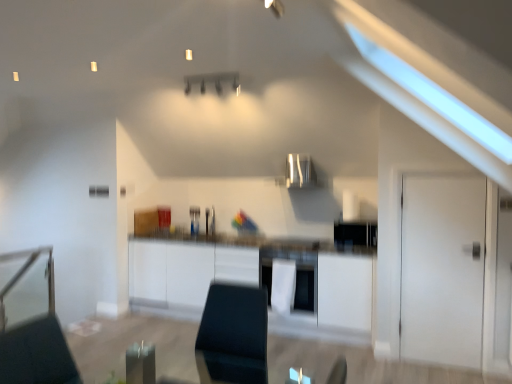
Question: Is white matte cabinet at center taller than satin silver exhaust hood at center?

Choices:
 (A) no
 (B) yes

Answer: (B)

Question: Would you say white matte cabinet at center is outside satin silver exhaust hood at center?

Choices:
 (A) yes
 (B) no

Answer: (A)

Question: From a real-world perspective, is white matte cabinet at center on satin silver exhaust hood at center?

Choices:
 (A) no
 (B) yes

Answer: (A)

Question: Does white matte cabinet at center have a lesser height compared to satin silver exhaust hood at center?

Choices:
 (A) no
 (B) yes

Answer: (A)

Question: Is white matte cabinet at center facing towards satin silver exhaust hood at center?

Choices:
 (A) yes
 (B) no

Answer: (B)

Question: Considering the positions of white glossy oven at center and satin silver exhaust hood at center in the image, is white glossy oven at center bigger or smaller than satin silver exhaust hood at center?

Choices:
 (A) big
 (B) small

Answer: (A)

Question: Looking at their shapes, would you say white glossy oven at center is wider or thinner than satin silver exhaust hood at center?

Choices:
 (A) thin
 (B) wide

Answer: (B)

Question: From their relative heights in the image, would you say white glossy oven at center is taller or shorter than satin silver exhaust hood at center?

Choices:
 (A) short
 (B) tall

Answer: (B)

Question: Considering their positions, is white glossy oven at center located in front of or behind satin silver exhaust hood at center?

Choices:
 (A) front
 (B) behind

Answer: (A)

Question: Relative to white matte cabinet at center, is white matte door at right in front or behind?

Choices:
 (A) front
 (B) behind

Answer: (A)

Question: Is white matte door at right inside or outside of white matte cabinet at center?

Choices:
 (A) inside
 (B) outside

Answer: (B)

Question: In terms of size, does white matte door at right appear bigger or smaller than white matte cabinet at center?

Choices:
 (A) big
 (B) small

Answer: (B)

Question: In terms of height, does white matte door at right look taller or shorter compared to white matte cabinet at center?

Choices:
 (A) short
 (B) tall

Answer: (B)

Question: Looking at their shapes, would you say white matte door at right is wider or thinner than white glossy oven at center?

Choices:
 (A) thin
 (B) wide

Answer: (A)

Question: From the image's perspective, is white matte door at right located above or below white glossy oven at center?

Choices:
 (A) below
 (B) above

Answer: (B)